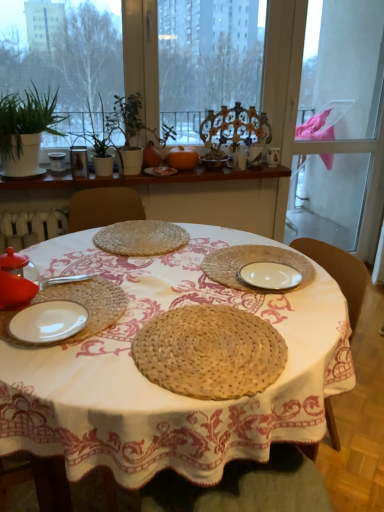
Describe the element at coordinates (141, 238) in the screenshot. I see `woven straw placemat at center, the 4th plate in the front-to-back sequence` at that location.

Find the location of `matte ceramic mug at upper center, which is the first tableware in top-to-bottom order`. matte ceramic mug at upper center, which is the first tableware in top-to-bottom order is located at coordinates (273, 156).

Find the location of a particular element. matte glass teapot at left, which ranks as the first tableware in bottom-to-top order is located at coordinates (15, 280).

Measure the distance between point (x=126, y=384) and camera.

35.20 inches.

Describe the element at coordinates (26, 129) in the screenshot. I see `green leafy plant at upper left` at that location.

The image size is (384, 512). I want to click on woven straw placemat at center, the 4th plate in the front-to-back sequence, so click(x=141, y=238).

Is point (33, 140) positioned before point (222, 160)?

Yes, it is.

From a real-world perspective, starting from the green leafy plant at upper left, which tableware is the 2nd one below it? Please provide its 2D coordinates.

[(213, 162)]

From the image's perspective, relative to matte brown bowl at center, which is the third tableware in left-to-right order, is green leafy plant at upper left above or below?

Clearly, from the image's perspective, green leafy plant at upper left is above matte brown bowl at center, which is the third tableware in left-to-right order.

Is wooden shelf at upper center located outside white ceramic cup at upper center, placed as the 4th tableware when sorted from bottom to top?

That's correct, wooden shelf at upper center is outside of white ceramic cup at upper center, placed as the 4th tableware when sorted from bottom to top.

At what (x,y) coordinates should I click in order to perform the action: click on window sill in front of the white ceramic cup at upper center, the second tableware viewed from the right. Please return your answer as a coordinate pair (x, y). Image resolution: width=384 pixels, height=512 pixels. Looking at the image, I should click on (143, 178).

Is wooden shelf at upper center further to the viewer compared to white ceramic cup at upper center, which is the 2th tableware in back-to-front order?

No.

Considering the relative positions of wooden shelf at upper center and white ceramic cup at upper center, the 2th tableware positioned from the top, in the image provided, is wooden shelf at upper center to the left of white ceramic cup at upper center, the 2th tableware positioned from the top, from the viewer's perspective?

Indeed, wooden shelf at upper center is positioned on the left side of white ceramic cup at upper center, the 2th tableware positioned from the top.

Can you confirm if matte brown bowl at center, the third tableware viewed from the right, is bigger than white ceramic cup at upper center, the 2th tableware positioned from the top?

Yes.

Which of these two, matte brown bowl at center, the 3th tableware in the top-to-bottom sequence, or white ceramic cup at upper center, the fourth tableware when ordered from front to back, stands shorter?

With less height is matte brown bowl at center, the 3th tableware in the top-to-bottom sequence.

From a real-world perspective, is matte brown bowl at center, which is counted as the 3th tableware, starting from the back, on white ceramic cup at upper center, the fourth tableware from the left?

Indeed, from a real-world perspective, matte brown bowl at center, which is counted as the 3th tableware, starting from the back, stands above white ceramic cup at upper center, the fourth tableware from the left.

Locate an element on the screen. Image resolution: width=384 pixels, height=512 pixels. the 1st tableware to the left of the white ceramic cup at upper center, placed as the 4th tableware when sorted from bottom to top, counting from the anchor's position is located at coordinates (213, 162).

Measure the distance from green leafy plant at upper left to woven straw placemat at center.

1.24 meters.

Considering the positions of objects green leafy plant at upper left and woven straw placemat at center in the image provided, who is behind, green leafy plant at upper left or woven straw placemat at center?

green leafy plant at upper left is more distant.

Between green leafy plant at upper left and woven straw placemat at center, which one has larger width?

Wider between the two is woven straw placemat at center.

Based on the photo, does green leafy plant at upper left have a greater height compared to woven straw placemat at center?

Correct, green leafy plant at upper left is much taller as woven straw placemat at center.

Is green leafy plant at upper left bigger than transparent glass screen door at right?

Actually, green leafy plant at upper left might be smaller than transparent glass screen door at right.

Does point (49, 100) come in front of point (383, 7)?

That is True.

From the image's perspective, is green leafy plant at upper left above transparent glass screen door at right?

No, from the image's perspective, green leafy plant at upper left is not above transparent glass screen door at right.

Considering the sizes of objects green leafy plant at upper left and transparent glass screen door at right in the image provided, who is taller, green leafy plant at upper left or transparent glass screen door at right?

Standing taller between the two is transparent glass screen door at right.

Considering the points (40, 140) and (110, 133), which point is behind, point (40, 140) or point (110, 133)?

Point (40, 140)

Can you tell me how much green leafy plant at upper left and green matte plant at upper center, which is the 1th plant in right-to-left order, differ in facing direction?

The facing directions of green leafy plant at upper left and green matte plant at upper center, which is the 1th plant in right-to-left order, are 0.00027 degrees apart.

Can you confirm if green leafy plant at upper left is bigger than green matte plant at upper center, which is the 1th plant in right-to-left order?

Correct, green leafy plant at upper left is larger in size than green matte plant at upper center, which is the 1th plant in right-to-left order.

Considering the relative positions of white matte plate at lower left, the 2th plate positioned from the bottom, and white woven plate at center, which ranks as the 3th plate in top-to-bottom order, in the image provided, is white matte plate at lower left, the 2th plate positioned from the bottom, in front of white woven plate at center, which ranks as the 3th plate in top-to-bottom order,?

Yes, it is in front of white woven plate at center, which ranks as the 3th plate in top-to-bottom order.

Considering the sizes of objects white matte plate at lower left, acting as the first plate starting from the front, and white woven plate at center, which ranks as the 3th plate in top-to-bottom order, in the image provided, who is thinner, white matte plate at lower left, acting as the first plate starting from the front, or white woven plate at center, which ranks as the 3th plate in top-to-bottom order,?

white matte plate at lower left, acting as the first plate starting from the front.

Is the surface of white matte plate at lower left, placed as the 5th plate when sorted from back to front, in direct contact with white woven plate at center, the 3th plate positioned from the front?

white matte plate at lower left, placed as the 5th plate when sorted from back to front, and white woven plate at center, the 3th plate positioned from the front, are clearly separated.

Locate an element on the screen. This screenshot has width=384, height=512. houseplant on the left of matte brown bowl at center, which is the third tableware in left-to-right order is located at coordinates (26, 129).

Image resolution: width=384 pixels, height=512 pixels. In order to click on window sill below the white ceramic cup at upper center, the 2th tableware positioned from the top (from the image's perspective) in this screenshot , I will do `click(143, 178)`.

Based on their spatial positions, is wooden shelf at upper center or transparent glass screen door at right closer to green leafy plant at upper left?

wooden shelf at upper center.

From the picture: From the image, which object appears to be nearer to white woven plate at center, the third plate from the back, white ceramic cup at upper center, the 2th tableware positioned from the top, or woven straw placemat at center, which is the 4th plate in bottom-to-top order?

The object closer to white woven plate at center, the third plate from the back, is woven straw placemat at center, which is the 4th plate in bottom-to-top order.

From the image, which object appears to be farther from woven straw placemat at center, the 4th plate in the front-to-back sequence, transparent glass screen door at right or matte brown bowl at center, which is counted as the 3th tableware, starting from the back?

transparent glass screen door at right.

Estimate the real-world distances between objects in this image. Which object is closer to green matte plant at upper left, which is the first plant in left-to-right order, white matte plate at lower left, the fourth plate when ordered from top to bottom, or matte glass vase at upper left, the fourth tableware viewed from the top?

matte glass vase at upper left, the fourth tableware viewed from the top, is positioned closer to the anchor green matte plant at upper left, which is the first plant in left-to-right order.

Consider the image. When comparing their distances from white woven plate at center, the 3th plate positioned from the front, does green leafy plant at upper left or woven straw placemat at center, the 4th plate in the front-to-back sequence, seem closer?

Among the two, woven straw placemat at center, the 4th plate in the front-to-back sequence, is located nearer to white woven plate at center, the 3th plate positioned from the front.

Which object lies further to the anchor point matte brown bowl at center, the 3th tableware in the top-to-bottom sequence, matte glass vase at upper left, marked as the 1th tableware in a left-to-right arrangement, or matte ceramic mug at upper center, which is counted as the 1th tableware, starting from the right?

The object further to matte brown bowl at center, the 3th tableware in the top-to-bottom sequence, is matte glass vase at upper left, marked as the 1th tableware in a left-to-right arrangement.

Which object lies further to the anchor point white matte plate at lower left, placed as the 5th plate when sorted from back to front, matte ceramic mug at upper center, placed as the first tableware when sorted from back to front, or white matte plate at center, the 5th plate positioned from the bottom?

Among the two, matte ceramic mug at upper center, placed as the first tableware when sorted from back to front, is located further to white matte plate at lower left, placed as the 5th plate when sorted from back to front.

Looking at the image, which one is located further to wooden shelf at upper center, woven straw placemat at center, which ranks as the 2th plate in back-to-front order, or matte ceramic mug at upper center, the fifth tableware in the bottom-to-top sequence?

woven straw placemat at center, which ranks as the 2th plate in back-to-front order, lies further to wooden shelf at upper center than the other object.

At what (x,y) coordinates should I click in order to perform the action: click on houseplant between white woven plate at center, the third plate from the back, and white ceramic cup at upper center, placed as the 4th tableware when sorted from bottom to top, along the z-axis. Please return your answer as a coordinate pair (x, y). Image resolution: width=384 pixels, height=512 pixels. Looking at the image, I should click on (26, 129).

Where is `window sill between green leafy plant at upper left and matte brown bowl at center, which is the third tableware in front-to-back order`? This screenshot has width=384, height=512. window sill between green leafy plant at upper left and matte brown bowl at center, which is the third tableware in front-to-back order is located at coordinates (143, 178).

Locate an element on the screen. Image resolution: width=384 pixels, height=512 pixels. tableware between woven straw placemat at center and wooden shelf at upper center in the front-back direction is located at coordinates (15, 280).

Where is `fruit situated between green leafy plant at upper left and matte brown bowl at center, which is the third tableware in front-to-back order, from left to right`? The image size is (384, 512). fruit situated between green leafy plant at upper left and matte brown bowl at center, which is the third tableware in front-to-back order, from left to right is located at coordinates (182, 157).